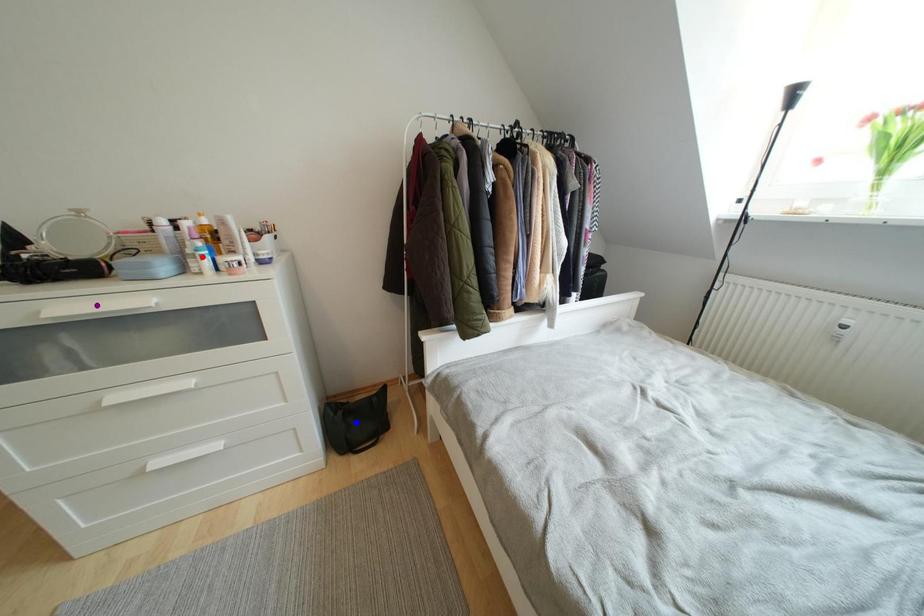
Order these from nearest to farthest:
blue point | red point | purple point

purple point < red point < blue point